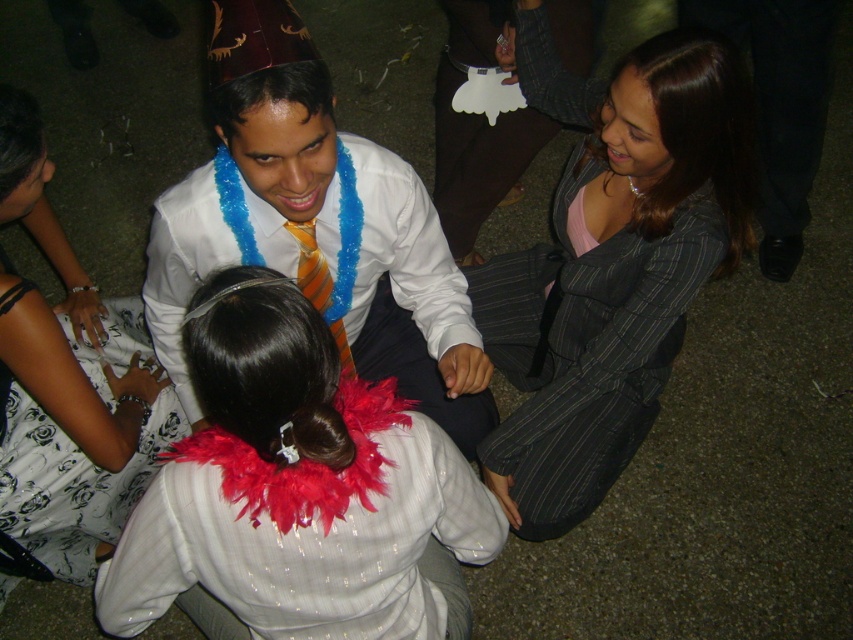
Question: Based on their relative distances, which object is nearer to the white satin shirt at center?

Choices:
 (A) white floral dress at lower left
 (B) gray pinstripe suit at center

Answer: (A)

Question: Among these points, which one is nearest to the camera?

Choices:
 (A) (572, 86)
 (B) (235, 387)
 (C) (347, 374)

Answer: (B)

Question: Is gray pinstripe suit at center bigger than white satin shirt at center?

Choices:
 (A) yes
 (B) no

Answer: (A)

Question: Which object appears farthest from the camera in this image?

Choices:
 (A) white floral dress at lower left
 (B) white feather boa at center
 (C) orangestriped fabrictie at center

Answer: (C)

Question: Is gray pinstripe suit at center above white floral dress at lower left?

Choices:
 (A) yes
 (B) no

Answer: (A)

Question: Can you confirm if white satin shirt at center is positioned below white floral dress at lower left?

Choices:
 (A) yes
 (B) no

Answer: (B)